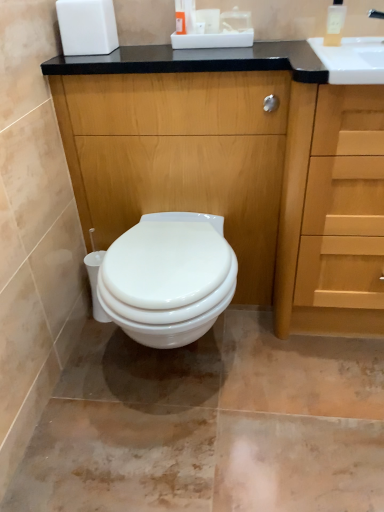
Question: Would you say translucent plastic soap dispenser at upper right is part of light wood drawer at right's contents?

Choices:
 (A) no
 (B) yes

Answer: (A)

Question: Is light wood drawer at right taller than translucent plastic soap dispenser at upper right?

Choices:
 (A) yes
 (B) no

Answer: (A)

Question: Is light wood drawer at right oriented towards translucent plastic soap dispenser at upper right?

Choices:
 (A) no
 (B) yes

Answer: (A)

Question: Is light wood drawer at right not close to translucent plastic soap dispenser at upper right?

Choices:
 (A) no
 (B) yes

Answer: (A)

Question: Considering the relative sizes of light wood drawer at right and translucent plastic soap dispenser at upper right in the image provided, is light wood drawer at right bigger than translucent plastic soap dispenser at upper right?

Choices:
 (A) no
 (B) yes

Answer: (B)

Question: From the image's perspective, is light wood drawer at right located above or below wooden cabinet at center?

Choices:
 (A) below
 (B) above

Answer: (A)

Question: Which is correct: light wood drawer at right is inside wooden cabinet at center, or outside of it?

Choices:
 (A) inside
 (B) outside

Answer: (B)

Question: In terms of width, does light wood drawer at right look wider or thinner when compared to wooden cabinet at center?

Choices:
 (A) thin
 (B) wide

Answer: (B)

Question: Is light wood drawer at right in front of or behind wooden cabinet at center in the image?

Choices:
 (A) front
 (B) behind

Answer: (A)

Question: From their relative heights in the image, would you say wooden cabinet at center is taller or shorter than light wood drawer at right?

Choices:
 (A) short
 (B) tall

Answer: (B)

Question: Is wooden cabinet at center to the left or to the right of light wood drawer at right in the image?

Choices:
 (A) left
 (B) right

Answer: (A)

Question: Considering their positions, is wooden cabinet at center located in front of or behind light wood drawer at right?

Choices:
 (A) front
 (B) behind

Answer: (B)

Question: From a real-world perspective, is wooden cabinet at center positioned above or below light wood drawer at right?

Choices:
 (A) above
 (B) below

Answer: (A)

Question: From the image's perspective, is translucent plastic soap dispenser at upper right above or below wooden cabinet at center?

Choices:
 (A) above
 (B) below

Answer: (A)

Question: Based on their sizes in the image, would you say translucent plastic soap dispenser at upper right is bigger or smaller than wooden cabinet at center?

Choices:
 (A) big
 (B) small

Answer: (B)